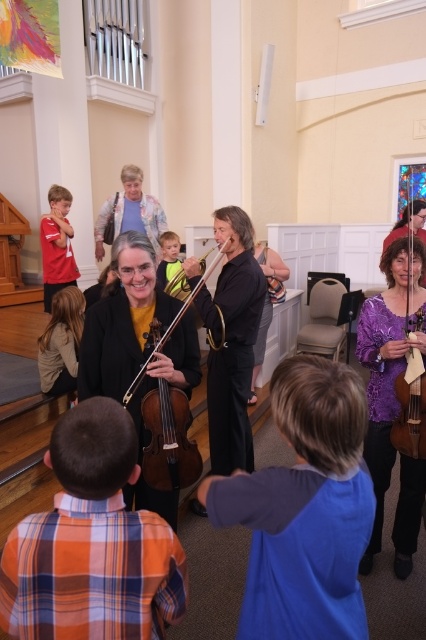
Question: Which of the following is the farthest from the observer?

Choices:
 (A) matte red shirt at left
 (B) matte black violin at center
 (C) wooden cello at center

Answer: (A)

Question: Does matte black violin at center appear on the right side of wooden cello at center?

Choices:
 (A) no
 (B) yes

Answer: (A)

Question: Estimate the real-world distances between objects in this image. Which object is farther from the matte red shirt at left?

Choices:
 (A) matte black violin at center
 (B) light brown hair at lower left
 (C) wooden cello at center

Answer: (C)

Question: Is light brown hair at lower left to the right of matte red shirt at left from the viewer's perspective?

Choices:
 (A) no
 (B) yes

Answer: (B)

Question: Does matte black violin at center have a lesser width compared to light brown hair at lower left?

Choices:
 (A) yes
 (B) no

Answer: (A)

Question: Which point is closer to the camera?

Choices:
 (A) matte black violin at center
 (B) wooden cello at center
 (C) matte red shirt at left
 (D) purple satin dress at center

Answer: (A)